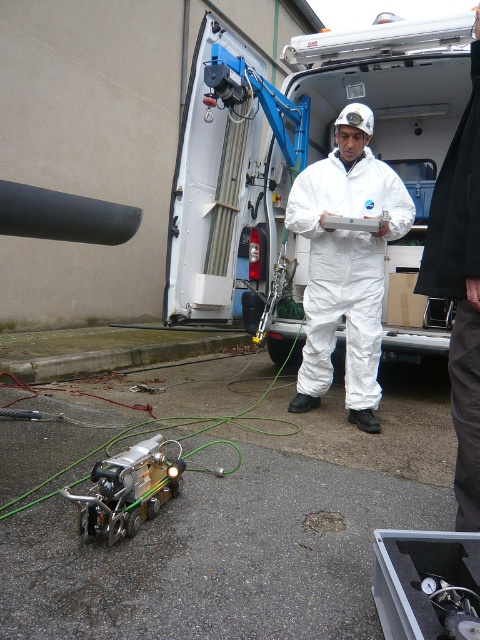
Question: Is white matte suit at center wider than metallic/brass-like robot at lower left?

Choices:
 (A) yes
 (B) no

Answer: (A)

Question: Is white matte suit at center thinner than metallic/brass-like robot at lower left?

Choices:
 (A) yes
 (B) no

Answer: (B)

Question: Does white matte suit at center come behind metallic/brass-like robot at lower left?

Choices:
 (A) no
 (B) yes

Answer: (B)

Question: Which point is farther to the camera?

Choices:
 (A) white matte suit at center
 (B) metallic/brass-like robot at lower left

Answer: (A)

Question: Which point is closer to the camera taking this photo?

Choices:
 (A) (326, 284)
 (B) (72, 499)

Answer: (B)